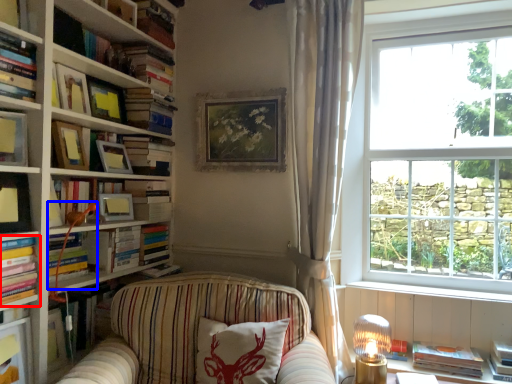
Question: Which object is further to the camera taking this photo, book (highlighted by a red box) or lamp (highlighted by a blue box)?

Choices:
 (A) book
 (B) lamp

Answer: (B)